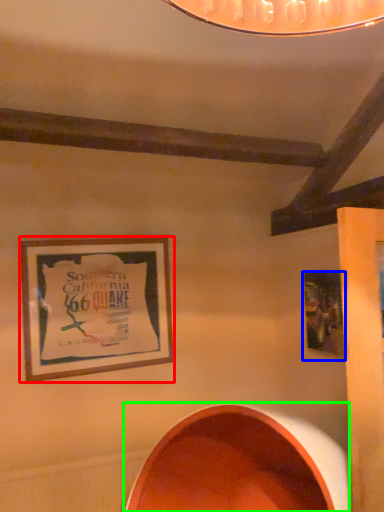
Question: Which object is the closest to the picture frame (highlighted by a red box)? Choose among these: picture frame (highlighted by a blue box) or oval (highlighted by a green box).

Choices:
 (A) picture frame
 (B) oval

Answer: (B)